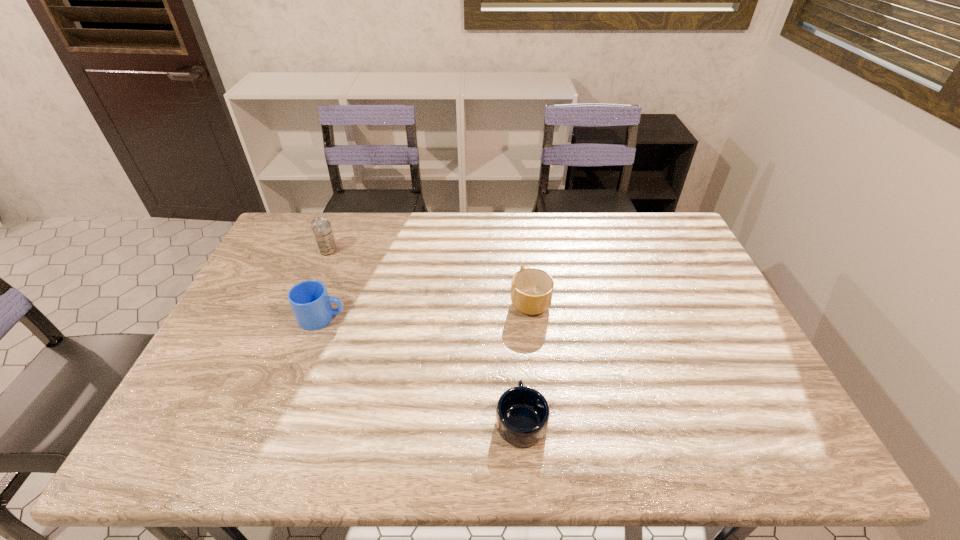
You are a GUI agent. You are given a task and a screenshot of the screen. Output one action in this format:
    pyautogui.click(x=<x>, y=<y>)
    Task: Click on the beer can
    The image size is (960, 540).
    Given the screenshot: What is the action you would take?
    pyautogui.click(x=321, y=228)

Locate an element on the screen. This screenshot has height=540, width=960. the leftmost mug is located at coordinates (309, 300).

Locate an element on the screen. the nearest object is located at coordinates (522, 414).

The image size is (960, 540). In order to click on the shortest mug in this screenshot , I will do `click(522, 414)`.

What are the coordinates of `vacant region located on the right of the beer can` in the screenshot? It's located at (x=367, y=251).

Where is `free space located 0.400m on the side of the leftmost mug with the handle`? Image resolution: width=960 pixels, height=540 pixels. free space located 0.400m on the side of the leftmost mug with the handle is located at coordinates (486, 318).

At what (x,y) coordinates should I click in order to perform the action: click on vacant region located with the handle on the side of the shortest object. Please return your answer as a coordinate pair (x, y). The image size is (960, 540). Looking at the image, I should click on (516, 357).

What are the coordinates of `free space located with the handle on the side of the shortest object` in the screenshot? It's located at (515, 340).

Identify the location of free spot located with the handle on the side of the shortest object. (511, 289).

Locate an element on the screen. Image resolution: width=960 pixels, height=540 pixels. object located at the far edge is located at coordinates coord(321,228).